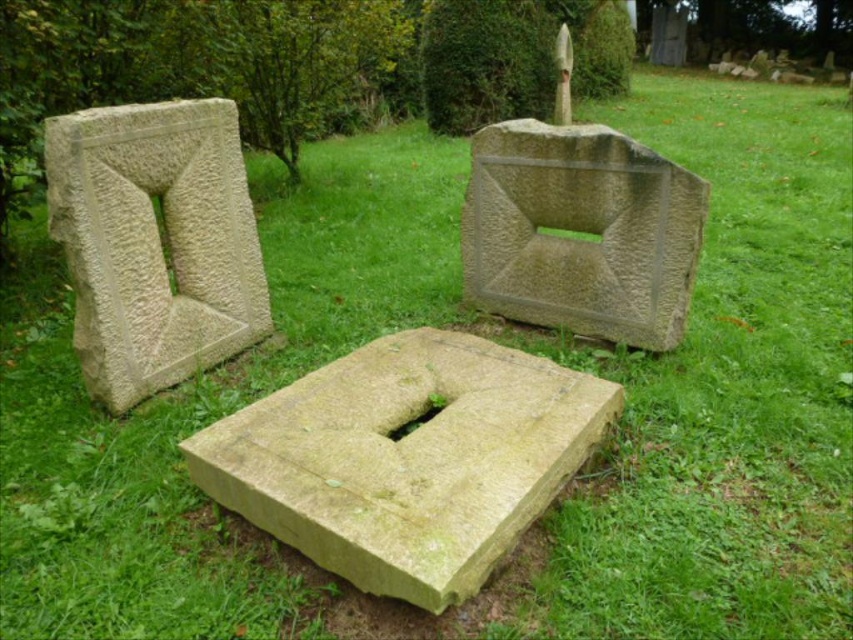
Question: Which object is farther from the camera taking this photo?

Choices:
 (A) beige rough stone at left
 (B) yellowish stone block at center

Answer: (A)

Question: Can you confirm if yellowish stone block at center is positioned to the left of beige rough stone at left?

Choices:
 (A) no
 (B) yes

Answer: (A)

Question: Which point appears closest to the camera in this image?

Choices:
 (A) (412, 602)
 (B) (572, 275)

Answer: (A)

Question: Does yellowish stone block at center come in front of gray rough stone at upper right?

Choices:
 (A) no
 (B) yes

Answer: (B)

Question: Among these objects, which one is farthest from the camera?

Choices:
 (A) gray rough stone at upper right
 (B) beige rough stone at left
 (C) yellowish stone block at center

Answer: (A)

Question: Is yellowish stone block at center to the left of beige rough stone at left from the viewer's perspective?

Choices:
 (A) yes
 (B) no

Answer: (B)